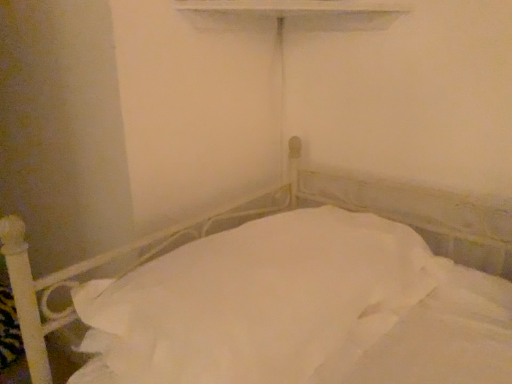
What is the approximate width of white fabric bed at center?

white fabric bed at center is 84.08 centimeters wide.

Describe the element at coordinates (275, 212) in the screenshot. I see `white fabric bed at center` at that location.

Locate an element on the screen. The height and width of the screenshot is (384, 512). white fabric bed at center is located at coordinates (275, 212).

The image size is (512, 384). I want to click on white painted wood at upper center, so click(x=304, y=12).

What is the approximate width of white painted wood at upper center?

white painted wood at upper center is 19.80 inches in width.

Image resolution: width=512 pixels, height=384 pixels. What do you see at coordinates (304, 12) in the screenshot?
I see `white painted wood at upper center` at bounding box center [304, 12].

Where is `white fabric bed at center`? white fabric bed at center is located at coordinates (275, 212).

Does white painted wood at upper center appear on the right side of white fabric bed at center?

Yes, white painted wood at upper center is to the right of white fabric bed at center.

Which object is further away from the camera, white painted wood at upper center or white fabric bed at center?

white painted wood at upper center is further away from the camera.

Does point (341, 7) come behind point (476, 257)?

No, it is not.

From the image's perspective, which one is positioned higher, white painted wood at upper center or white fabric bed at center?

white painted wood at upper center appears higher in the image.

From a real-world perspective, is white painted wood at upper center positioned over white fabric bed at center based on gravity?

Yes, from a real-world perspective, white painted wood at upper center is over white fabric bed at center

Between white painted wood at upper center and white fabric bed at center, which one has larger width?

Wider between the two is white fabric bed at center.

Between white painted wood at upper center and white fabric bed at center, which one has less height?

Standing shorter between the two is white painted wood at upper center.

Can you confirm if white painted wood at upper center is smaller than white fabric bed at center?

Yes.

Is white painted wood at upper center located outside white fabric bed at center?

Yes, white painted wood at upper center is not within white fabric bed at center.

Is white painted wood at upper center far away from white fabric bed at center?

No, white painted wood at upper center is in close proximity to white fabric bed at center.

Is white painted wood at upper center oriented towards white fabric bed at center?

No, white painted wood at upper center is not facing towards white fabric bed at center.

How much distance is there between white painted wood at upper center and white fabric bed at center?

white painted wood at upper center is 21.23 inches away from white fabric bed at center.

In the image, there is a white fabric bed at center. Identify the location of window sill above it (from the image's perspective). Image resolution: width=512 pixels, height=384 pixels. (304, 12).

Can you confirm if white fabric bed at center is positioned to the right of white painted wood at upper center?

No, white fabric bed at center is not to the right of white painted wood at upper center.

In the image, is white fabric bed at center positioned in front of or behind white painted wood at upper center?

Clearly, white fabric bed at center is in front of white painted wood at upper center.

Between point (12, 228) and point (344, 24), which one is positioned in front?

The point (12, 228) is closer to the camera.

From the image's perspective, does white fabric bed at center appear higher than white painted wood at upper center?

No.

From a real-world perspective, between white fabric bed at center and white painted wood at upper center, who is vertically lower?

white fabric bed at center.

Considering the sizes of white fabric bed at center and white painted wood at upper center in the image, is white fabric bed at center wider or thinner than white painted wood at upper center?

In the image, white fabric bed at center appears to be wider than white painted wood at upper center.

Is white fabric bed at center taller than white painted wood at upper center?

Yes.

Does white fabric bed at center have a smaller size compared to white painted wood at upper center?

Incorrect, white fabric bed at center is not smaller in size than white painted wood at upper center.

Is white fabric bed at center situated inside white painted wood at upper center or outside?

white fabric bed at center is spatially situated outside white painted wood at upper center.

Are white fabric bed at center and white painted wood at upper center located far from each other?

That's not correct — white fabric bed at center is a little close to white painted wood at upper center.

Is white fabric bed at center oriented away from white painted wood at upper center?

white fabric bed at center does not have its back to white painted wood at upper center.

Where is `bed below the white painted wood at upper center (from the image's perspective)`? This screenshot has height=384, width=512. bed below the white painted wood at upper center (from the image's perspective) is located at coordinates (275, 212).

Identify the location of window sill above the white fabric bed at center (from a real-world perspective). The image size is (512, 384). pyautogui.click(x=304, y=12).

The width and height of the screenshot is (512, 384). I want to click on window sill above the white fabric bed at center (from the image's perspective), so click(x=304, y=12).